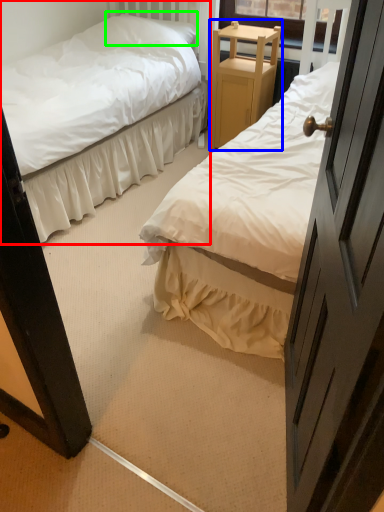
Question: Which object is positioned farthest from bed (highlighted by a red box)? Select from furniture (highlighted by a blue box) and pillow (highlighted by a green box).

Choices:
 (A) furniture
 (B) pillow

Answer: (B)